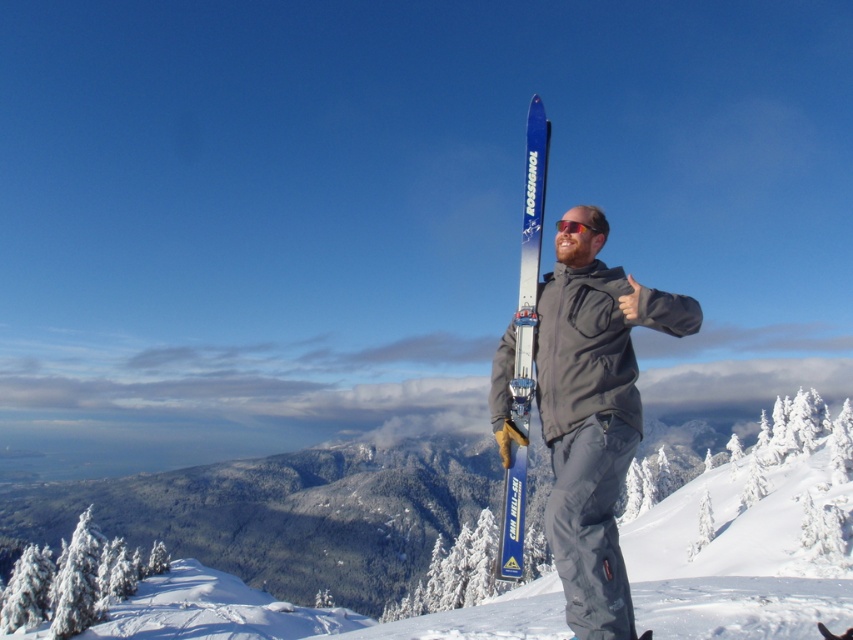
Is matte gray jacket at center wider than shiny orange sunglasses at center?

Yes, matte gray jacket at center is wider than shiny orange sunglasses at center.

Who is shorter, matte gray jacket at center or shiny orange sunglasses at center?

shiny orange sunglasses at center

Image resolution: width=853 pixels, height=640 pixels. What do you see at coordinates (593, 413) in the screenshot? I see `matte gray jacket at center` at bounding box center [593, 413].

Identify the location of matte gray jacket at center. (593, 413).

Is point (836, 509) farther from camera compared to point (509, 474)?

That is True.

Does white powder snow at center have a smaller size compared to blue metallic ski at center?

No, white powder snow at center is not smaller than blue metallic ski at center.

You are a GUI agent. You are given a task and a screenshot of the screen. Output one action in this format:
    pyautogui.click(x=<x>, y=<y>)
    Task: Click on the white powder snow at center
    The image size is (853, 640).
    Given the screenshot: What is the action you would take?
    pyautogui.click(x=751, y=536)

Is white powder snow at center smaller than matte gray jacket at center?

No, white powder snow at center is not smaller than matte gray jacket at center.

Which is more to the left, white powder snow at center or matte gray jacket at center?

Positioned to the left is white powder snow at center.

Is point (817, 497) positioned before point (619, 385)?

No, (817, 497) is further to viewer.

This screenshot has width=853, height=640. I want to click on white powder snow at center, so click(751, 536).